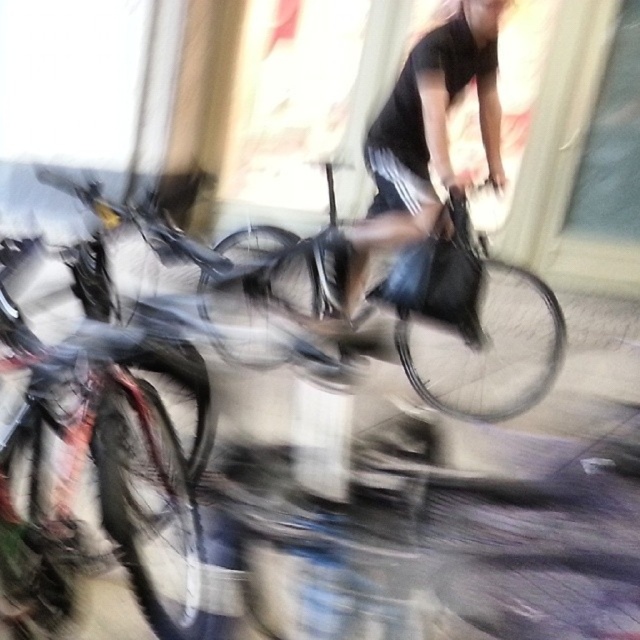
Question: Which of the following is the closest to the observer?

Choices:
 (A) (394, 200)
 (B) (467, 340)

Answer: (B)

Question: Among these points, which one is nearest to the camera?

Choices:
 (A) (340, 272)
 (B) (44, 516)

Answer: (B)

Question: Can you confirm if shiny metallic bicycle at center is positioned to the right of black matte bag at center?

Choices:
 (A) no
 (B) yes

Answer: (B)

Question: Which point appears farthest from the camera in this image?

Choices:
 (A) coord(28,440)
 (B) coord(515,275)
 (C) coord(445,145)

Answer: (B)

Question: Does shiny metallic bicycle at left have a lesser width compared to shiny metallic bicycle at center?

Choices:
 (A) no
 (B) yes

Answer: (B)

Question: Observing the image, what is the correct spatial positioning of shiny metallic bicycle at left in reference to black matte bag at center?

Choices:
 (A) left
 (B) right

Answer: (A)